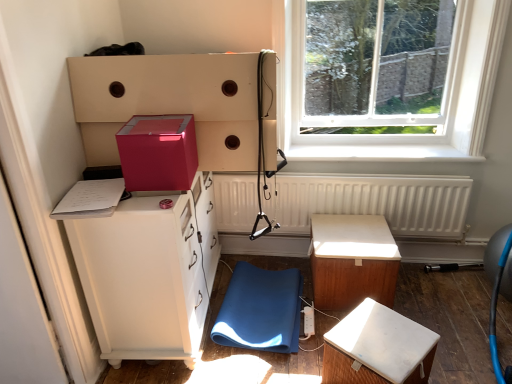
Describe the element at coordinates (378, 348) in the screenshot. I see `white matte stool at lower right` at that location.

What is the approximate width of matte pink box at upper left?

9.62 inches.

This screenshot has width=512, height=384. What are the coordinates of `matte pink box at upper left` in the screenshot? It's located at (158, 152).

What is the approximate height of matte white cabinet at left?

The height of matte white cabinet at left is 34.91 inches.

Describe the element at coordinates (260, 310) in the screenshot. I see `blue fabric swivel chair at lower center` at that location.

Find the location of a particular element. The width and height of the screenshot is (512, 384). matte pink cube at upper center is located at coordinates (170, 103).

Based on the photo, from a real-world perspective, is wooden table at center beneath blue fabric swivel chair at lower center?

No, from a real-world perspective, wooden table at center is not beneath blue fabric swivel chair at lower center.

Is wooden table at center in front of or behind blue fabric swivel chair at lower center in the image?

Clearly, wooden table at center is behind blue fabric swivel chair at lower center.

Can you confirm if wooden table at center is smaller than blue fabric swivel chair at lower center?

No, wooden table at center is not smaller than blue fabric swivel chair at lower center.

Image resolution: width=512 pixels, height=384 pixels. What are the coordinates of `swivel chair located in front of the wooden table at center` in the screenshot? It's located at (260, 310).

Between blue fabric swivel chair at lower center and transparent glass window at upper right, which one has smaller width?

With smaller width is transparent glass window at upper right.

Is blue fabric swivel chair at lower center at the right side of transparent glass window at upper right?

In fact, blue fabric swivel chair at lower center is to the left of transparent glass window at upper right.

Is blue fabric swivel chair at lower center taller than transparent glass window at upper right?

No.

In the scene shown: In the image, is blue fabric swivel chair at lower center positioned in front of or behind transparent glass window at upper right?

Visually, blue fabric swivel chair at lower center is located in front of transparent glass window at upper right.

Who is bigger, white matte radiator at center or matte pink box at upper left?

With larger size is white matte radiator at center.

How many degrees apart are the facing directions of white matte radiator at center and matte pink box at upper left?

They differ by 0.86 degrees in their facing directions.

From a real-world perspective, is white matte radiator at center on matte pink box at upper left?

No.

Consider the image. How much distance is there between white matte radiator at center and matte pink box at upper left?

97.22 centimeters.

Find the location of a particular element. The image size is (512, 384). electric outlet lying above the white matte stool at lower right (from the image's perspective) is located at coordinates (x=308, y=322).

From the image's perspective, is white plastic power strip at lower center located beneath white matte stool at lower right?

Incorrect, from the image's perspective, white plastic power strip at lower center is higher than white matte stool at lower right.

Who is shorter, white plastic power strip at lower center or white matte stool at lower right?

With less height is white plastic power strip at lower center.

Is white plastic power strip at lower center positioned far away from white matte stool at lower right?

Actually, white plastic power strip at lower center and white matte stool at lower right are a little close together.

Which object is wider, transparent glass window at upper right or matte white cabinet at left?

With larger width is matte white cabinet at left.

Considering the relative sizes of transparent glass window at upper right and matte white cabinet at left in the image provided, is transparent glass window at upper right shorter than matte white cabinet at left?

Yes.

From a real-world perspective, between transparent glass window at upper right and matte white cabinet at left, who is vertically higher?

transparent glass window at upper right.

Considering the relative positions of transparent glass window at upper right and matte white cabinet at left in the image provided, is transparent glass window at upper right in front of matte white cabinet at left?

That is False.

Considering the relative sizes of white matte radiator at center and transparent glass window at upper right in the image provided, is white matte radiator at center shorter than transparent glass window at upper right?

Yes, white matte radiator at center is shorter than transparent glass window at upper right.

Is white matte radiator at center facing towards transparent glass window at upper right?

No, white matte radiator at center does not turn towards transparent glass window at upper right.

What's the angular difference between white matte radiator at center and transparent glass window at upper right's facing directions?

0.756 degrees separate the facing orientations of white matte radiator at center and transparent glass window at upper right.

In the scene shown: From the image's perspective, who appears lower, white matte radiator at center or transparent glass window at upper right?

white matte radiator at center appears lower in the image.

From the image's perspective, which is below, blue fabric swivel chair at lower center or matte pink box at upper left?

blue fabric swivel chair at lower center is shown below in the image.

Which object is further away from the camera, blue fabric swivel chair at lower center or matte pink box at upper left?

blue fabric swivel chair at lower center is behind.

Does blue fabric swivel chair at lower center have a greater width compared to matte pink box at upper left?

Indeed, blue fabric swivel chair at lower center has a greater width compared to matte pink box at upper left.

From a real-world perspective, does blue fabric swivel chair at lower center stand above matte pink box at upper left?

No.

This screenshot has width=512, height=384. In order to click on table above the blue fabric swivel chair at lower center (from the image's perspective) in this screenshot , I will do `click(352, 260)`.

The image size is (512, 384). I want to click on window on the right side of blue fabric swivel chair at lower center, so click(x=390, y=78).

Which object lies further to the anchor point blue fabric swivel chair at lower center, matte white cabinet at left or matte pink cube at upper center?

matte pink cube at upper center.

When comparing their distances from matte pink cube at upper center, does matte white cabinet at left or white matte stool at lower right seem closer?

matte white cabinet at left is closer to matte pink cube at upper center.

Considering their positions, is transparent glass window at upper right positioned closer to matte pink box at upper left than matte white cabinet at left?

matte white cabinet at left is positioned closer to the anchor matte pink box at upper left.

Which object lies further to the anchor point white matte radiator at center, transparent glass window at upper right or blue fabric swivel chair at lower center?

Based on the image, blue fabric swivel chair at lower center appears to be further to white matte radiator at center.

Looking at the image, which one is located closer to matte white cabinet at left, matte pink cube at upper center or transparent glass window at upper right?

matte pink cube at upper center lies closer to matte white cabinet at left than the other object.

Considering their positions, is white matte stool at lower right positioned further to matte white cabinet at left than blue fabric swivel chair at lower center?

white matte stool at lower right is positioned further to the anchor matte white cabinet at left.

Considering their positions, is transparent glass window at upper right positioned closer to white plastic power strip at lower center than white matte stool at lower right?

white matte stool at lower right is positioned closer to the anchor white plastic power strip at lower center.

From the picture: Based on their spatial positions, is blue fabric swivel chair at lower center or matte pink cube at upper center further from white matte radiator at center?

matte pink cube at upper center is further to white matte radiator at center.

The image size is (512, 384). I want to click on table between matte pink box at upper left and white matte radiator at center in the horizontal direction, so click(352, 260).

Image resolution: width=512 pixels, height=384 pixels. I want to click on table between blue fabric swivel chair at lower center and white matte radiator at center, so click(x=352, y=260).

Locate an element on the screen. The width and height of the screenshot is (512, 384). shelf between matte pink box at upper left and wooden table at center from left to right is located at coordinates (170, 103).

Image resolution: width=512 pixels, height=384 pixels. What are the coordinates of `box that lies between matte pink cube at upper center and white matte stool at lower right from top to bottom` in the screenshot? It's located at (158, 152).